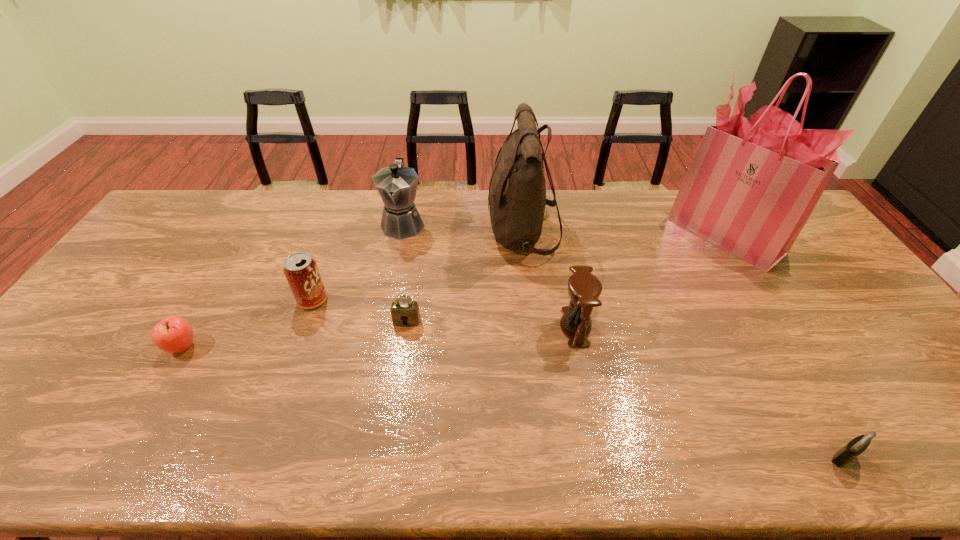
Identify which object is the sixth closest to the nearer padlock. Please provide its 2D coordinates. Your answer should be formatted as a tuple, i.e. [(x, y)], where the tuple contains the x and y coordinates of a point satisfying the conditions above.

[(300, 269)]

This screenshot has height=540, width=960. Find the location of `vacant space that satisfies the following two spatial constraints: 1. at the front of the right padlock near the keyhole; 2. on the right side of the left padlock`. vacant space that satisfies the following two spatial constraints: 1. at the front of the right padlock near the keyhole; 2. on the right side of the left padlock is located at coordinates (386, 457).